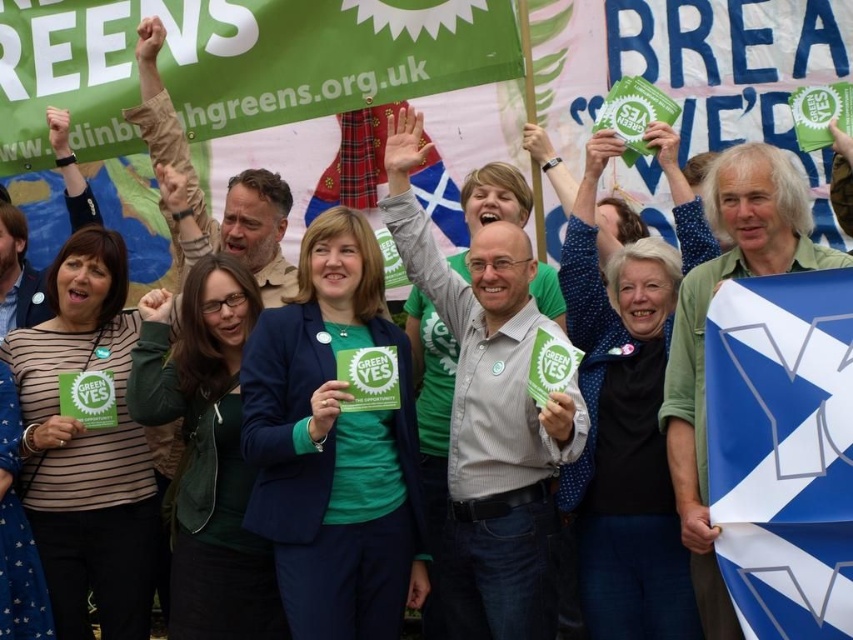
You are a photographer standing at the center of the event. You want to capture a photo that includes the green fabric banner at upper left. Where should you position yourself to ensure the banner is visible in your shot?

The green fabric banner at upper left is located at point (235, 61), so positioning yourself towards the center of the event should allow the banner to be visible in your shot.

You are organizing a parade and need to decide which banner to place at the front for visibility. The green fabric banner at upper left and the blue fabric flag at right are available. Based on their sizes, which one should you choose?

The green fabric banner at upper left should be placed at the front because its width is larger than the blue fabric flag at right, making it more visible from a distance.

You are a photographer at this event and want to capture both the green fabric banner at upper left and the blue fabric flag at right in a single frame. Given their sizes, which object should you focus on to ensure both are clearly visible in your photo?

The green fabric banner at upper left is larger than the blue fabric flag at right. To ensure both are clearly visible, focus on the green fabric banner at upper left as it occupies more space in the frame, allowing the smaller blue fabric flag at right to still be captured within the same shot.